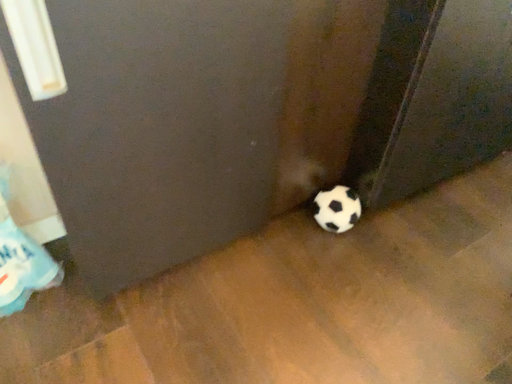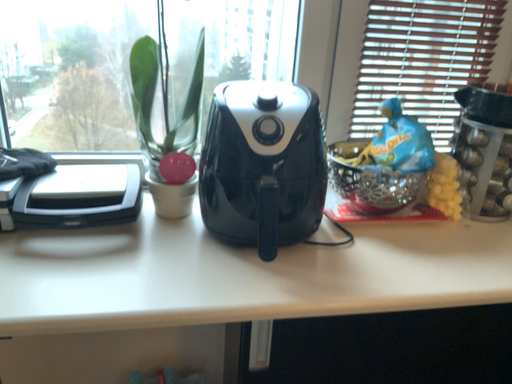
Question: Which way did the camera rotate in the video?

Choices:
 (A) rotated right
 (B) rotated left

Answer: (B)